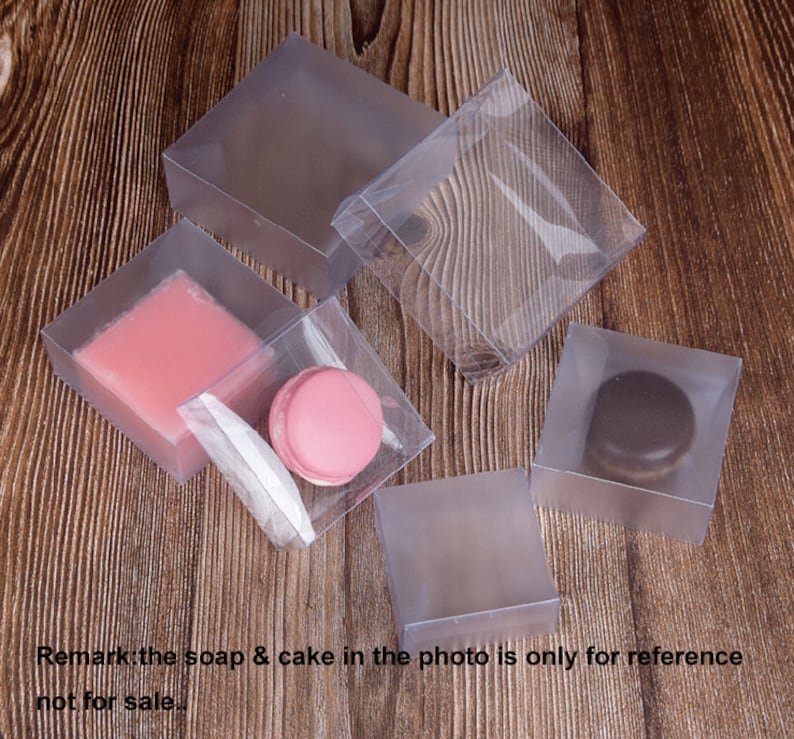
Where is `box`? The height and width of the screenshot is (739, 794). box is located at coordinates (309, 320).